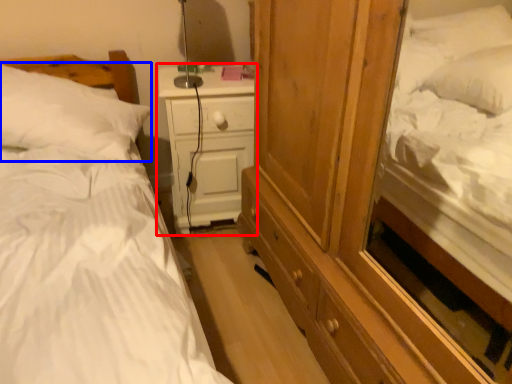
Question: Which point is closer to the camera, nightstand (highlighted by a red box) or pillow (highlighted by a blue box)?

Choices:
 (A) nightstand
 (B) pillow

Answer: (B)